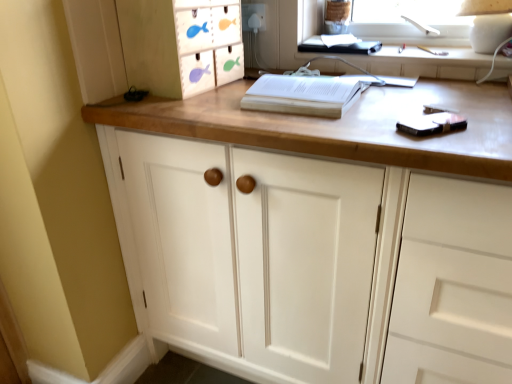
Question: Is wooden fish-themed drawer at upper left positioned with its back to white paper at center?

Choices:
 (A) no
 (B) yes

Answer: (A)

Question: Could you tell me if wooden fish-themed drawer at upper left is facing white paper at center?

Choices:
 (A) yes
 (B) no

Answer: (A)

Question: Considering the relative sizes of wooden fish-themed drawer at upper left and white paper at center in the image provided, is wooden fish-themed drawer at upper left taller than white paper at center?

Choices:
 (A) no
 (B) yes

Answer: (B)

Question: Does wooden fish-themed drawer at upper left have a smaller size compared to white paper at center?

Choices:
 (A) no
 (B) yes

Answer: (A)

Question: From a real-world perspective, is wooden fish-themed drawer at upper left below white paper at center?

Choices:
 (A) yes
 (B) no

Answer: (B)

Question: Is white plastic electric outlet at upper center in front of or behind white wood cabinet at center in the image?

Choices:
 (A) front
 (B) behind

Answer: (B)

Question: Is white plastic electric outlet at upper center taller or shorter than white wood cabinet at center?

Choices:
 (A) tall
 (B) short

Answer: (B)

Question: From a real-world perspective, relative to white wood cabinet at center, is white plastic electric outlet at upper center vertically above or below?

Choices:
 (A) above
 (B) below

Answer: (A)

Question: Would you say white plastic electric outlet at upper center is to the left or to the right of white wood cabinet at center in the picture?

Choices:
 (A) left
 (B) right

Answer: (A)

Question: Considering the positions of point (247, 11) and point (285, 76), is point (247, 11) closer or farther from the camera than point (285, 76)?

Choices:
 (A) farther
 (B) closer

Answer: (A)

Question: Would you say white plastic electric outlet at upper center is inside or outside white paper at center?

Choices:
 (A) outside
 (B) inside

Answer: (A)

Question: Is white plastic electric outlet at upper center in front of or behind white paper at center in the image?

Choices:
 (A) front
 (B) behind

Answer: (B)

Question: From the image's perspective, is white plastic electric outlet at upper center located above or below white paper at center?

Choices:
 (A) below
 (B) above

Answer: (B)

Question: Do you think white paper at center is within white plastic electric outlet at upper center, or outside of it?

Choices:
 (A) inside
 (B) outside

Answer: (B)

Question: In terms of height, does white paper at center look taller or shorter compared to white plastic electric outlet at upper center?

Choices:
 (A) short
 (B) tall

Answer: (A)